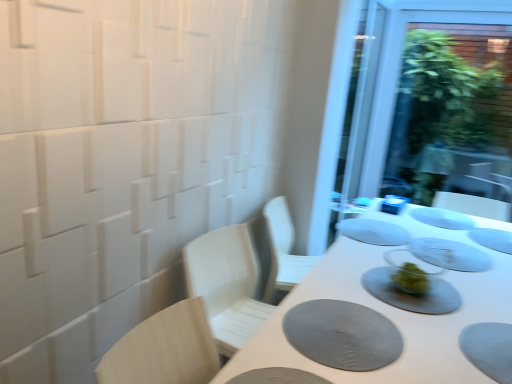
At what (x,y) coordinates should I click in order to perform the action: click on free region under matte white plate at center, the 4th tableware when ordered from front to back (from a real-world perspective). Please return your answer as a coordinate pair (x, y). Looking at the image, I should click on (375, 231).